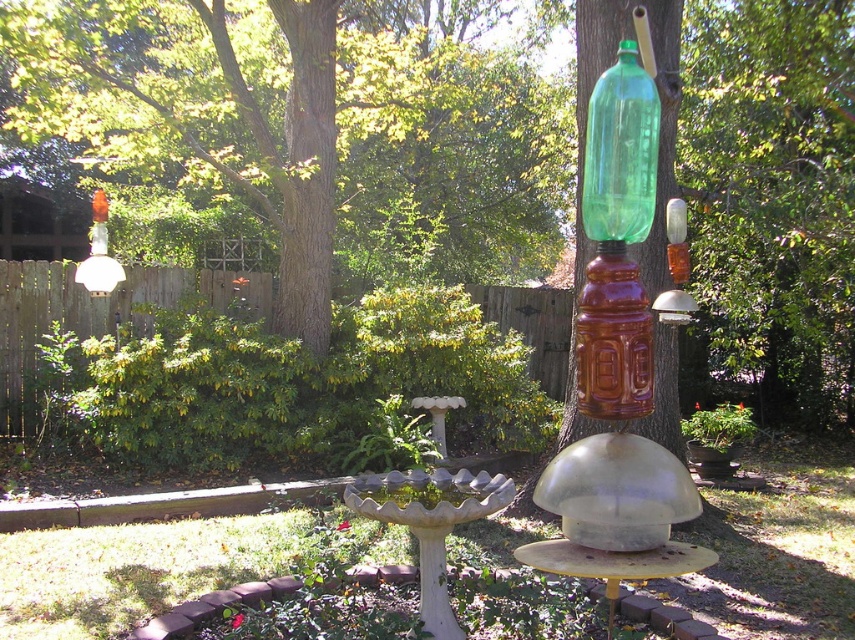
You are a landscape designer planning to add a new pathway in the garden scene. The pathway must start from the base of the sculpture and extend towards the green leafy tree at upper left. What coordinates should the pathway be directed towards?

The pathway should be directed towards the coordinates point (314, 129) where the green leafy tree at upper left is located.

You are a photographer setting up a shot of the garden scene. You need to ensure both the green leafy tree at upper left and the green glass bottle at upper center are in frame. Which object should you adjust your camera to focus on first to ensure both are visible?

You should focus on the green leafy tree at upper left first because its width is larger than the green glass bottle at upper center, so ensuring it fits will naturally include the smaller bottle in the frame.